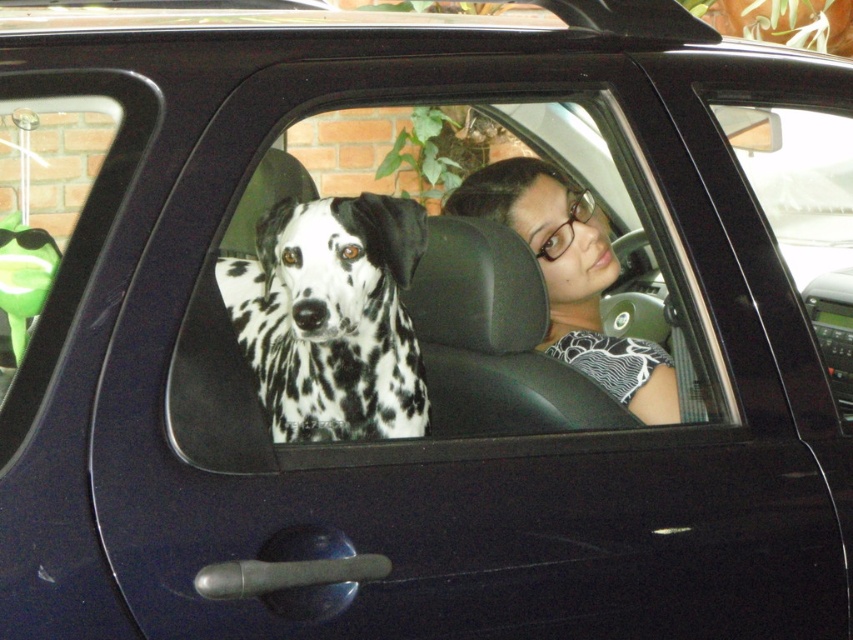
Question: Does black and white spotted dog at center have a smaller size compared to matte black shirt at center?

Choices:
 (A) yes
 (B) no

Answer: (A)

Question: Does black leather car window at center have a greater width compared to black and white spotted dog at center?

Choices:
 (A) no
 (B) yes

Answer: (B)

Question: Which point is closer to the camera?

Choices:
 (A) black leather car window at center
 (B) matte black shirt at center
 (C) black and white spotted dog at center

Answer: (A)

Question: Based on their relative distances, which object is nearer to the black leather car window at center?

Choices:
 (A) black and white spotted dog at center
 (B) matte black shirt at center

Answer: (A)

Question: Can you confirm if black leather car window at center is bigger than matte black shirt at center?

Choices:
 (A) yes
 (B) no

Answer: (A)

Question: Which is farther from the black leather car window at center?

Choices:
 (A) black and white spotted dog at center
 (B) matte black shirt at center

Answer: (B)